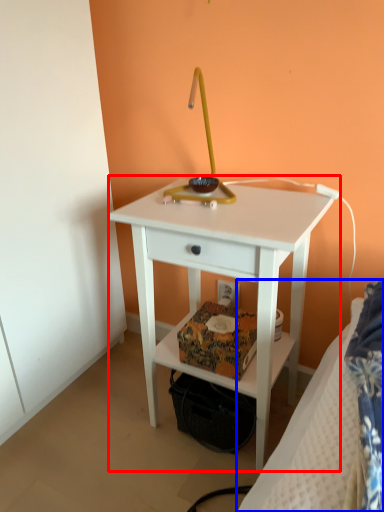
Question: Which object appears closest to the camera in this image, nightstand (highlighted by a red box) or bed (highlighted by a blue box)?

Choices:
 (A) nightstand
 (B) bed

Answer: (B)